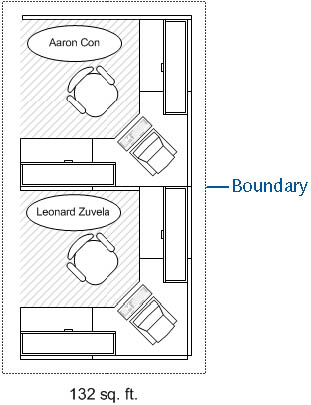
Where is `drawing of monitors`? The image size is (311, 405). drawing of monitors is located at coordinates (150, 331), (160, 160).